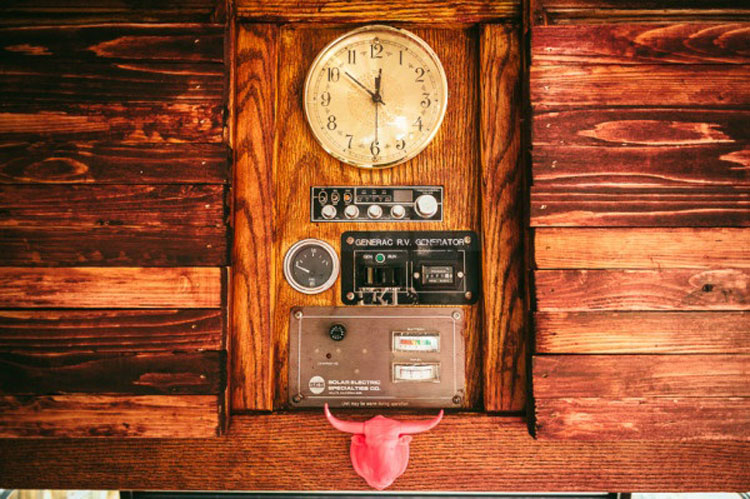
Where is `clock`? This screenshot has height=499, width=750. clock is located at coordinates (376, 115).